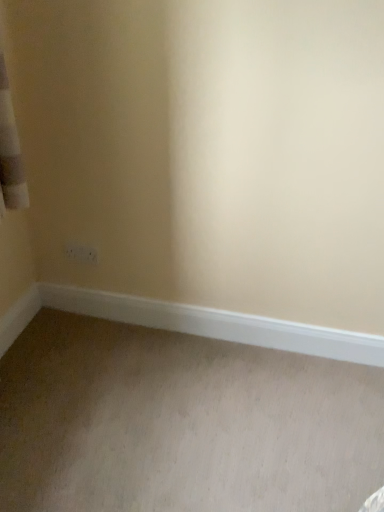
What do you see at coordinates (181, 423) in the screenshot?
I see `beige carpet at lower left` at bounding box center [181, 423].

At what (x,y) coordinates should I click in order to perform the action: click on beige carpet at lower left. Please return your answer as a coordinate pair (x, y). Looking at the image, I should click on (181, 423).

What is the approximate width of white smooth baseboard at lower center?

It is 1.76 inches.

Where is `white smooth baseboard at lower center`? white smooth baseboard at lower center is located at coordinates (216, 324).

What do you see at coordinates (216, 324) in the screenshot? The height and width of the screenshot is (512, 384). I see `white smooth baseboard at lower center` at bounding box center [216, 324].

The height and width of the screenshot is (512, 384). I want to click on beige carpet at lower left, so click(181, 423).

Which is more to the right, beige carpet at lower left or white smooth baseboard at lower center?

From the viewer's perspective, white smooth baseboard at lower center appears more on the right side.

Is beige carpet at lower left positioned before white smooth baseboard at lower center?

Yes.

Is point (251, 498) less distant than point (180, 305)?

That is True.

From the image's perspective, is beige carpet at lower left above or below white smooth baseboard at lower center?

From the image's perspective, beige carpet at lower left appears below white smooth baseboard at lower center.

From a real-world perspective, between beige carpet at lower left and white smooth baseboard at lower center, who is vertically higher?

white smooth baseboard at lower center, from a real-world perspective.

Which object is wider, beige carpet at lower left or white smooth baseboard at lower center?

beige carpet at lower left.

Considering the relative sizes of beige carpet at lower left and white smooth baseboard at lower center in the image provided, is beige carpet at lower left shorter than white smooth baseboard at lower center?

Yes, beige carpet at lower left is shorter than white smooth baseboard at lower center.

Which of these two, beige carpet at lower left or white smooth baseboard at lower center, is bigger?

Bigger between the two is beige carpet at lower left.

Is beige carpet at lower left not inside white smooth baseboard at lower center?

Yes, beige carpet at lower left is outside of white smooth baseboard at lower center.

Are beige carpet at lower left and white smooth baseboard at lower center making contact?

No, beige carpet at lower left is not with white smooth baseboard at lower center.

Is white smooth baseboard at lower center at the back of beige carpet at lower left?

beige carpet at lower left is not turned away from white smooth baseboard at lower center.

How different are the orientations of beige carpet at lower left and white smooth baseboard at lower center in degrees?

They differ by 90 degrees in their facing directions.

You are a GUI agent. You are given a task and a screenshot of the screen. Output one action in this format:
    pyautogui.click(x=<x>, y=<y>)
    Task: Click on the plain located on the left of white smooth baseboard at lower center
    Image resolution: width=384 pixels, height=512 pixels.
    Given the screenshot: What is the action you would take?
    pyautogui.click(x=181, y=423)

Is white smooth baseboard at lower center to the left of beige carpet at lower left from the viewer's perspective?

In fact, white smooth baseboard at lower center is to the right of beige carpet at lower left.

Looking at this image, does white smooth baseboard at lower center lie in front of beige carpet at lower left?

No, white smooth baseboard at lower center is behind beige carpet at lower left.

Which is nearer, (x=57, y=308) or (x=160, y=499)?

The point (x=160, y=499) is closer.

From the image's perspective, is white smooth baseboard at lower center located beneath beige carpet at lower left?

Actually, white smooth baseboard at lower center appears above beige carpet at lower left in the image.

From a real-world perspective, which object rests below the other?

In real-world perspective, beige carpet at lower left is lower.

Considering the sizes of objects white smooth baseboard at lower center and beige carpet at lower left in the image provided, who is thinner, white smooth baseboard at lower center or beige carpet at lower left?

With smaller width is white smooth baseboard at lower center.

Is white smooth baseboard at lower center shorter than beige carpet at lower left?

No, white smooth baseboard at lower center is not shorter than beige carpet at lower left.

Considering the relative sizes of white smooth baseboard at lower center and beige carpet at lower left in the image provided, is white smooth baseboard at lower center smaller than beige carpet at lower left?

Yes.

Is beige carpet at lower left surrounded by white smooth baseboard at lower center?

No, beige carpet at lower left is not a part of white smooth baseboard at lower center.

Is there a large distance between white smooth baseboard at lower center and beige carpet at lower left?

No, white smooth baseboard at lower center is not far away from beige carpet at lower left.

Could you tell me if white smooth baseboard at lower center is facing beige carpet at lower left?

Yes, white smooth baseboard at lower center is turned towards beige carpet at lower left.

How many degrees apart are the facing directions of white smooth baseboard at lower center and beige carpet at lower left?

90 degrees.

In the image, there is a white smooth baseboard at lower center. Where is `plain below it (from a real-world perspective)`? The image size is (384, 512). plain below it (from a real-world perspective) is located at coordinates (181, 423).

This screenshot has height=512, width=384. I want to click on plain below the white smooth baseboard at lower center (from the image's perspective), so click(181, 423).

Identify the location of plain in front of the white smooth baseboard at lower center. (181, 423).